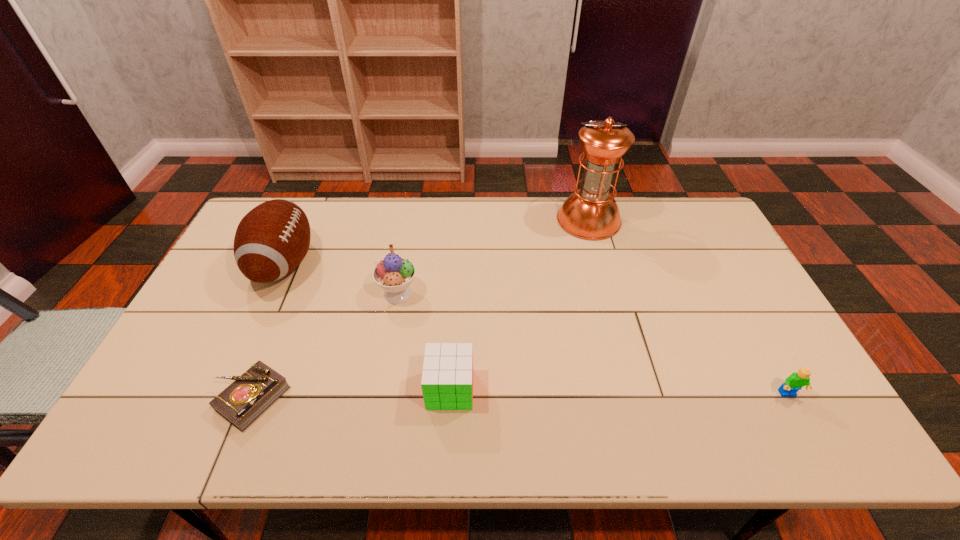
Locate an element on the screen. blank area located 0.120m on the left of the icecream is located at coordinates (337, 293).

Identify the location of free space located on the right of the fourth object from left to right. (522, 389).

This screenshot has height=540, width=960. What are the coordinates of `free space located 0.140m on the left of the diary` in the screenshot? It's located at (158, 398).

Where is `oil lamp that is at the far edge`? The height and width of the screenshot is (540, 960). oil lamp that is at the far edge is located at coordinates (591, 213).

At what (x,y) coordinates should I click in order to perform the action: click on football that is at the far edge. Please return your answer as a coordinate pair (x, y). The width and height of the screenshot is (960, 540). Looking at the image, I should click on (271, 240).

The height and width of the screenshot is (540, 960). I want to click on object present at the near edge, so click(x=242, y=402).

Where is `object located at the left edge`? object located at the left edge is located at coordinates (271, 240).

Find the location of a particular element. object at the right edge is located at coordinates (797, 380).

Where is `object that is at the far left corner`? The height and width of the screenshot is (540, 960). object that is at the far left corner is located at coordinates (271, 240).

I want to click on free space at the far edge of the desktop, so click(357, 202).